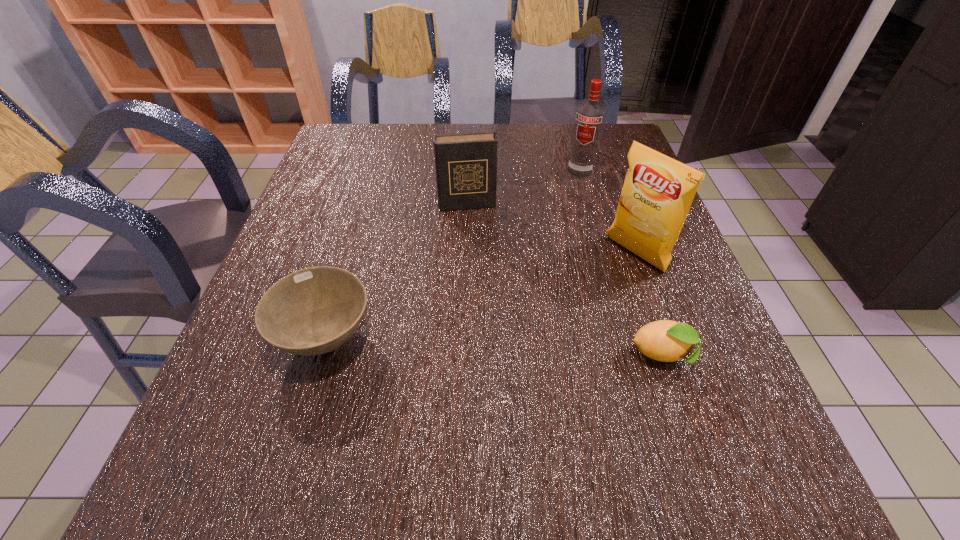
You are a GUI agent. You are given a task and a screenshot of the screen. Output one action in this format:
    pyautogui.click(x=<x>, y=<y>)
    Task: Click on the bowl
    The width and height of the screenshot is (960, 540).
    Given the screenshot: What is the action you would take?
    pyautogui.click(x=312, y=311)

Find the location of a particular element. the fourth tallest object is located at coordinates (312, 311).

The image size is (960, 540). I want to click on lemon, so click(665, 340).

What are the coordinates of `the farthest object` in the screenshot? It's located at (589, 119).

At what (x,y) coordinates should I click in order to perform the action: click on the second farthest object. Please return your answer as a coordinate pair (x, y). The height and width of the screenshot is (540, 960). Looking at the image, I should click on (466, 164).

The height and width of the screenshot is (540, 960). Identify the location of diary. [466, 164].

Identify the location of the third farthest object. (658, 190).

Image resolution: width=960 pixels, height=540 pixels. I want to click on vacant point located on the back of the fourth tallest object, so click(369, 195).

The height and width of the screenshot is (540, 960). I want to click on free location located 0.060m with leaves positioned above the shortest object, so click(731, 355).

Find the location of `free location located 0.050m on the front label of the vodka`. free location located 0.050m on the front label of the vodka is located at coordinates (572, 188).